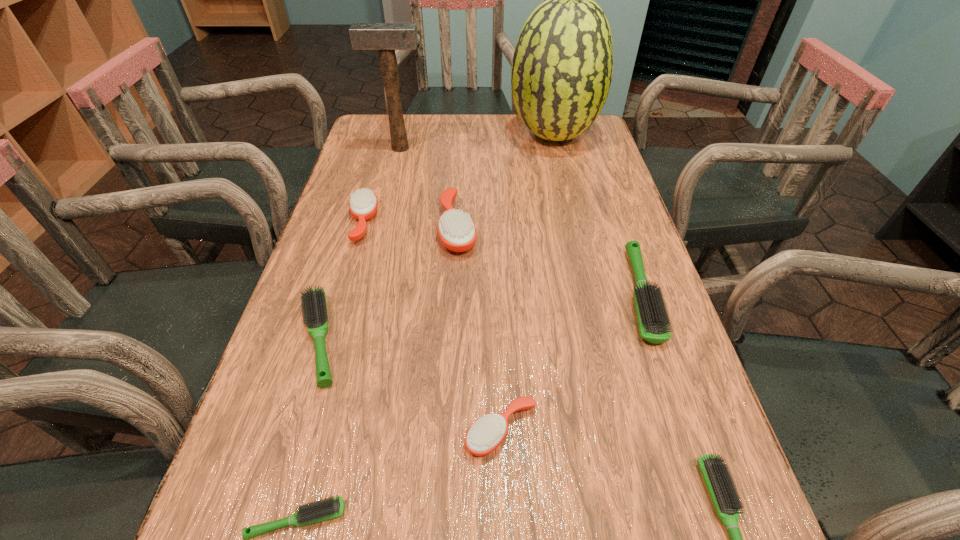
Locate an element on the screen. vacant area that lies between the mallet and the third smallest light hairbrush is located at coordinates point(359,244).

Identify the location of vacant region between the green watermelon and the biggest light hairbrush. (596, 215).

Locate an element on the screen. This screenshot has width=960, height=540. free area in between the leftmost orange hairbrush and the mallet is located at coordinates (381, 185).

The width and height of the screenshot is (960, 540). Identify the location of vacant area that lies between the second biggest orange hairbrush and the biggest light hairbrush. (500, 258).

Locate an element on the screen. This screenshot has height=540, width=960. empty space between the biggest light hairbrush and the smallest orange hairbrush is located at coordinates (570, 362).

At what (x,y) coordinates should I click in order to perform the action: click on object that is the nearest to the watermelon. Please return your answer as a coordinate pair (x, y). The image size is (960, 540). Looking at the image, I should click on tap(457, 232).

Select which object is the eighth closest to the mallet. Please provide its 2D coordinates. Your answer should be formatted as a tuple, i.e. [(x, y)], where the tuple contains the x and y coordinates of a point satisfying the conditions above.

[(726, 501)]

The height and width of the screenshot is (540, 960). I want to click on hairbrush that is the fifth closest to the leftmost orange hairbrush, so click(x=652, y=318).

Select which hairbrush is the closest to the tallest hairbrush. Please provide its 2D coordinates. Your answer should be formatted as a tuple, i.e. [(x, y)], where the tuple contains the x and y coordinates of a point satisfying the conditions above.

[(363, 204)]

The height and width of the screenshot is (540, 960). I want to click on orange hairbrush that is the second closest to the biggest orange hairbrush, so tap(487, 433).